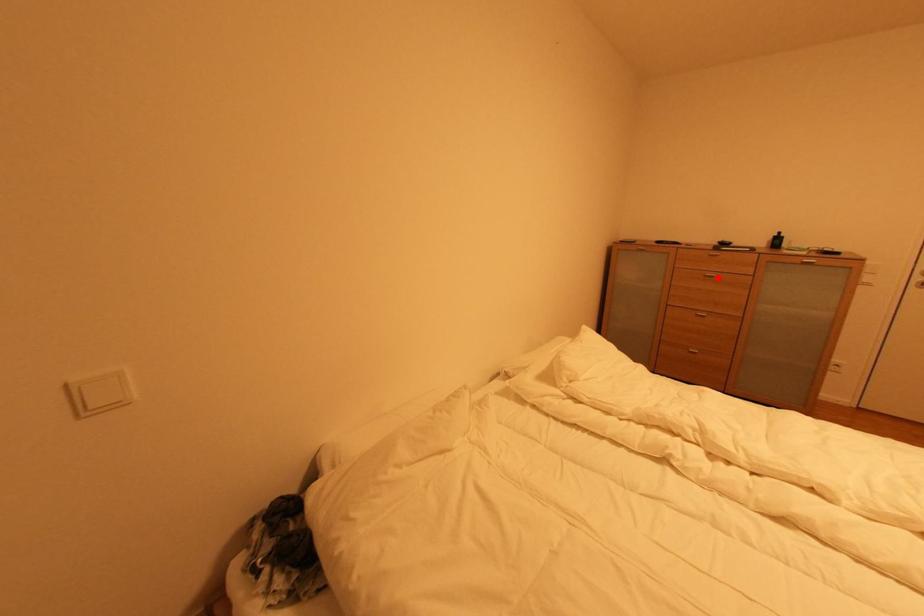
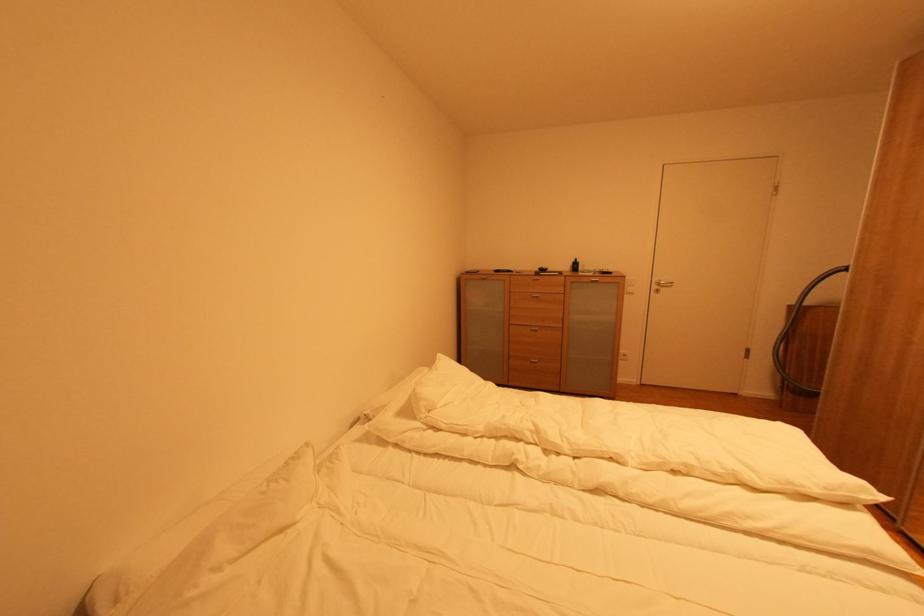
Where in the second image is the point corresponding to the highlighted location from the first image?

(542, 298)